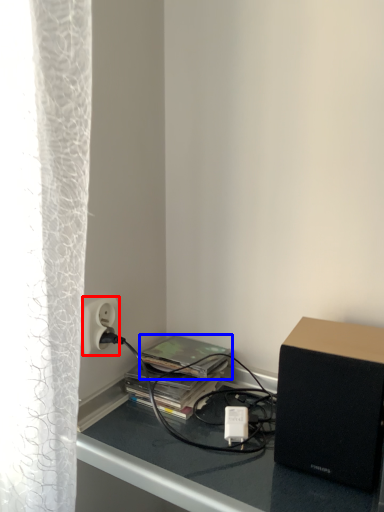
Question: Which point is further to the camera, power outlet (highlighted by a red box) or paperback book (highlighted by a blue box)?

Choices:
 (A) power outlet
 (B) paperback book

Answer: (B)